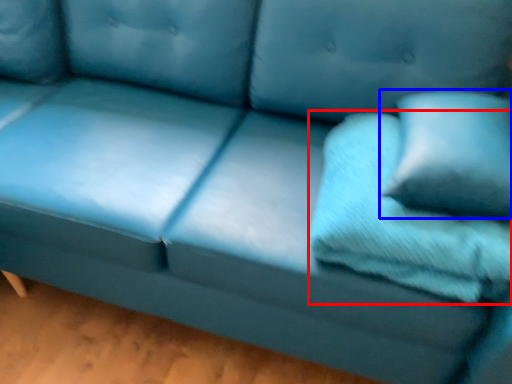
Question: Among these objects, which one is nearest to the camera, pillow (highlighted by a red box) or pillow (highlighted by a blue box)?

Choices:
 (A) pillow
 (B) pillow

Answer: (B)